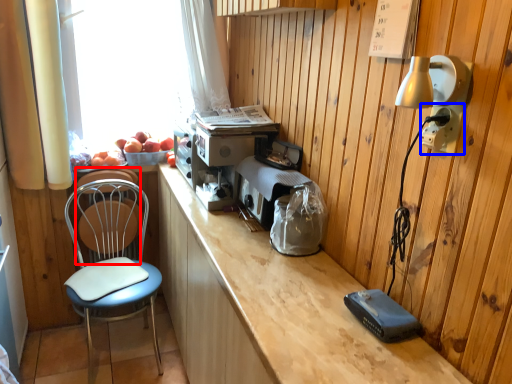
Question: Which point is further to the camera, armchair (highlighted by a red box) or electric outlet (highlighted by a blue box)?

Choices:
 (A) armchair
 (B) electric outlet

Answer: (A)